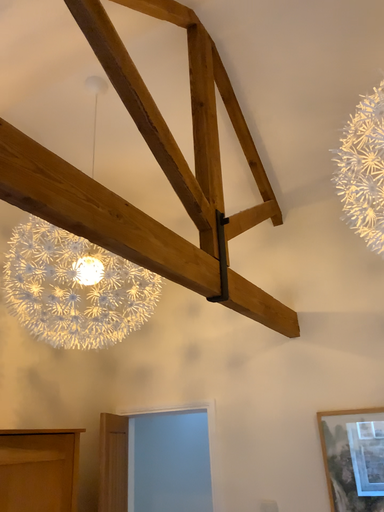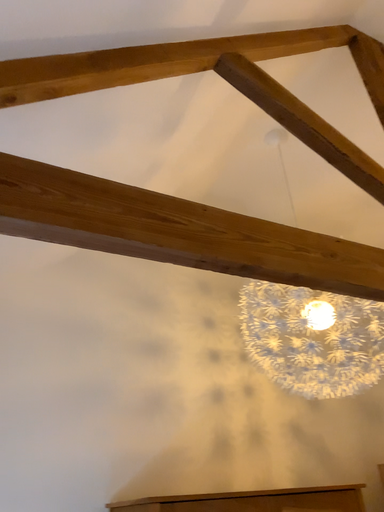
Question: How did the camera likely rotate when shooting the video?

Choices:
 (A) rotated left
 (B) rotated right

Answer: (A)